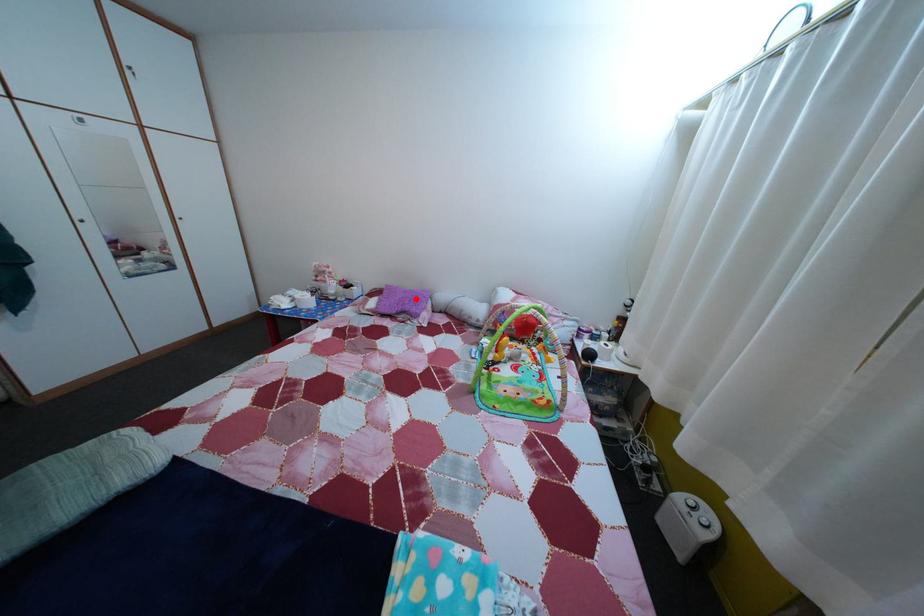
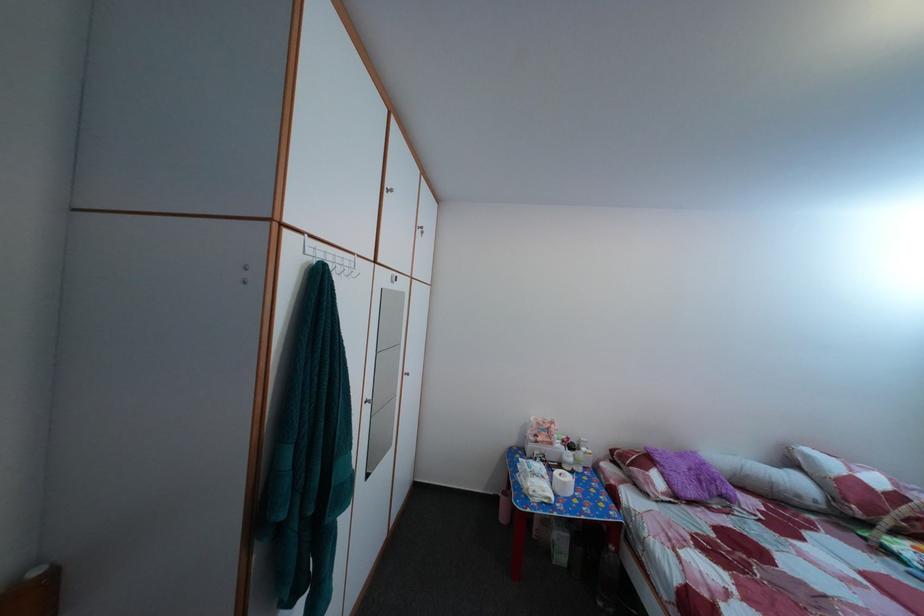
Question: I am providing you with two images of the same scene from different viewpoints. A red point is marked on the first image. Can you still see the location of the red point in image 2?

Choices:
 (A) Yes
 (B) No

Answer: (A)